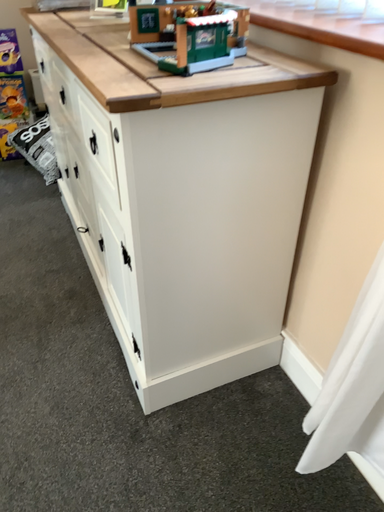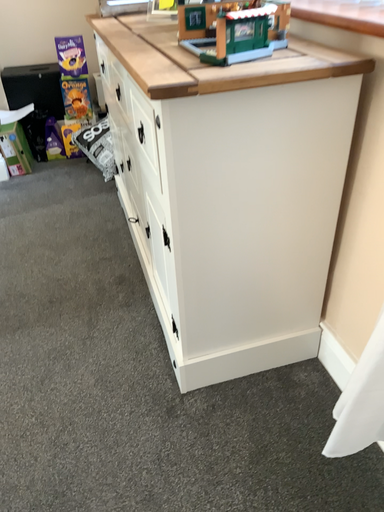
Question: How did the camera likely rotate when shooting the video?

Choices:
 (A) rotated right
 (B) rotated left

Answer: (B)